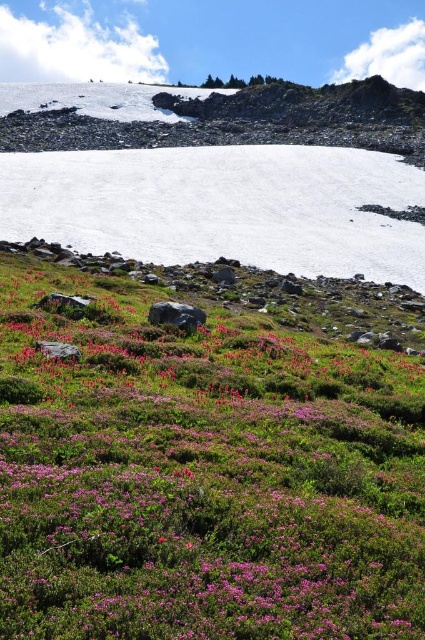
Between point (74, 497) and point (167, 236), which one is positioned behind?

Positioned behind is point (167, 236).

Is purple leafy grass at lower center to the left of white matte snow at center from the viewer's perspective?

No, purple leafy grass at lower center is not to the left of white matte snow at center.

What do you see at coordinates (204, 460) in the screenshot? I see `purple leafy grass at lower center` at bounding box center [204, 460].

I want to click on purple leafy grass at lower center, so click(x=204, y=460).